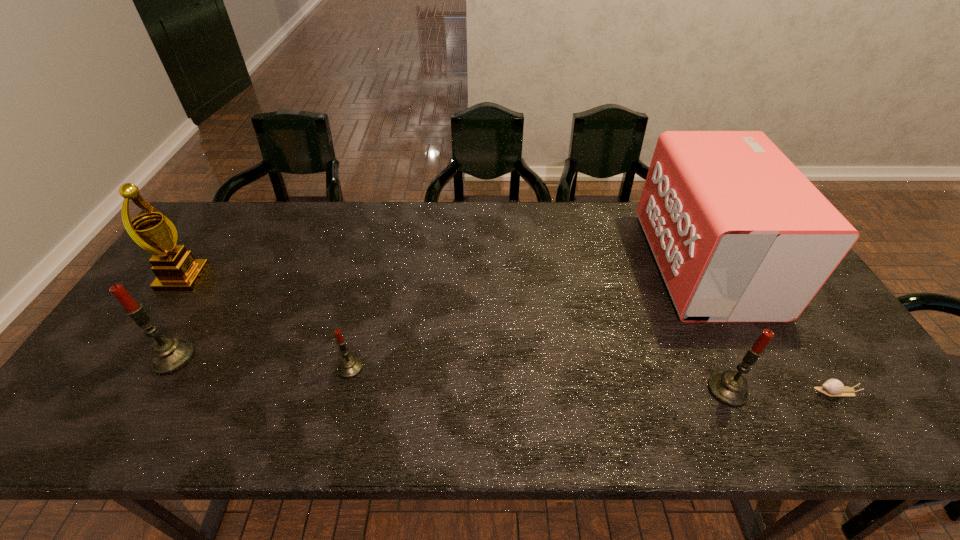
Please point a location where one more candle can be added evenly. Please provide its 2D coordinates. Your answer should be formatted as a tuple, i.e. [(x, y)], where the tuple contains the x and y coordinates of a point satisfying the conditions above.

[(535, 379)]